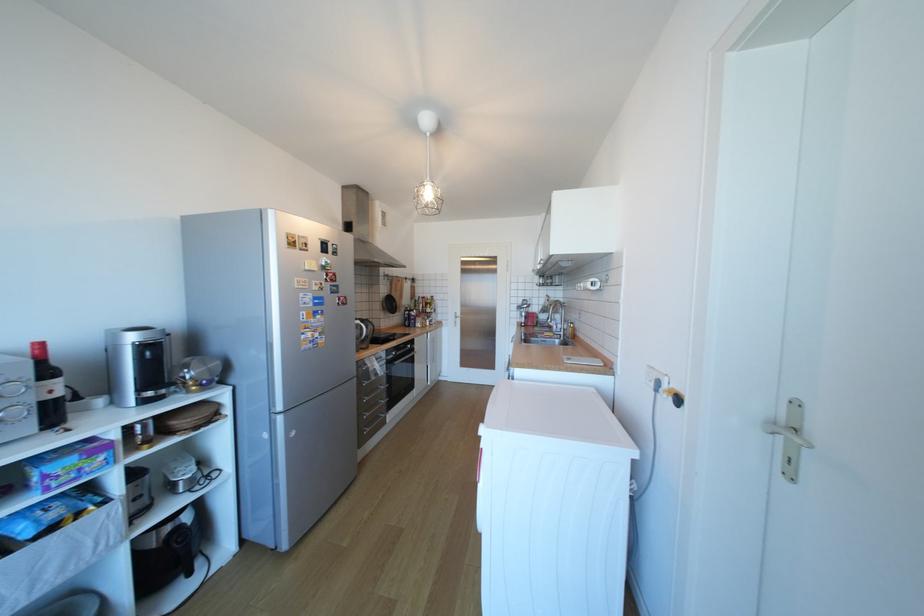
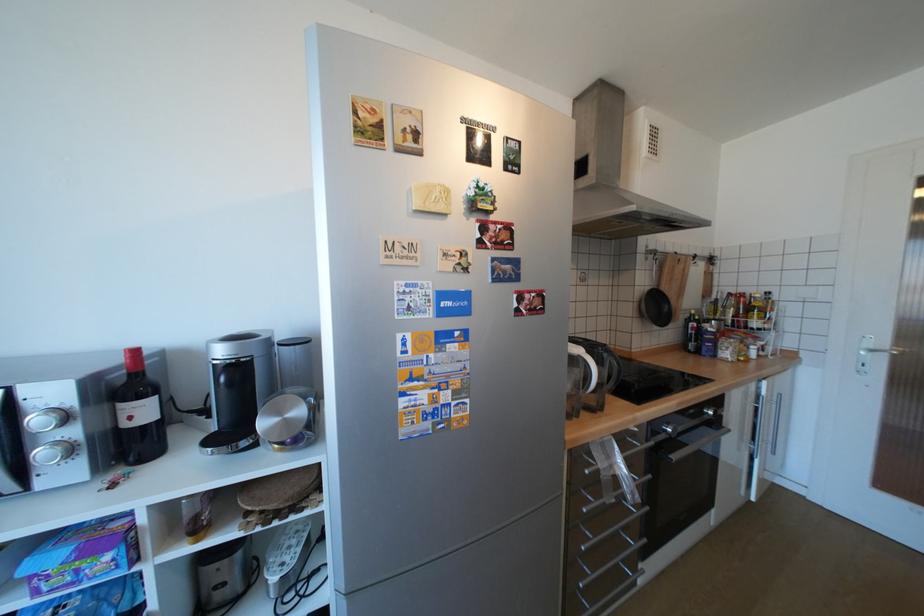
Where in the second image is the point corresponding to (81,476) from the first image?

(79, 578)